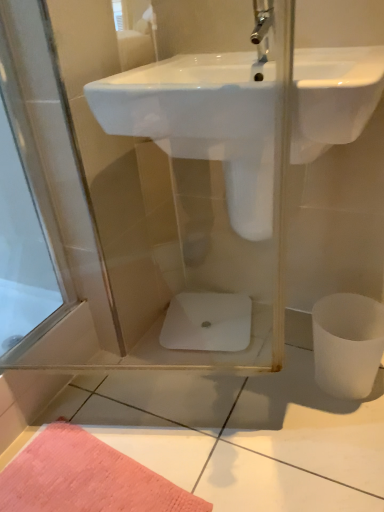
Find the location of a particular element. free location in front of white matte toilet bowl at lower right, the second toilet bowl when ordered from left to right is located at coordinates (351, 436).